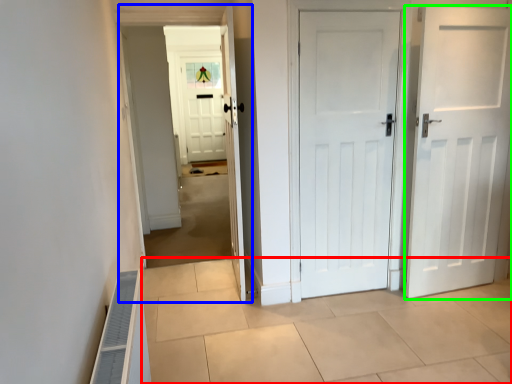
Question: Considering the real-world distances, which object is farthest from path (highlighted by a red box)? corridor (highlighted by a blue box) or door (highlighted by a green box)?

Choices:
 (A) corridor
 (B) door

Answer: (A)